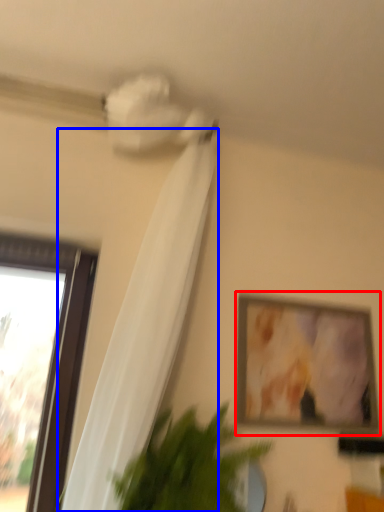
Question: Which of the following is the farthest to the observer, picture frame (highlighted by a red box) or curtain (highlighted by a blue box)?

Choices:
 (A) picture frame
 (B) curtain

Answer: (A)